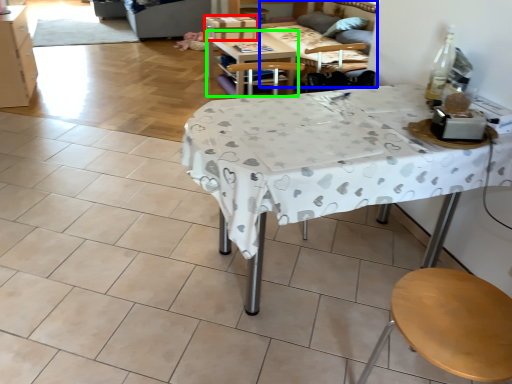
Question: Which is farther away from box (highlighted by a red box)? couch (highlighted by a blue box) or table (highlighted by a green box)?

Choices:
 (A) couch
 (B) table

Answer: (A)